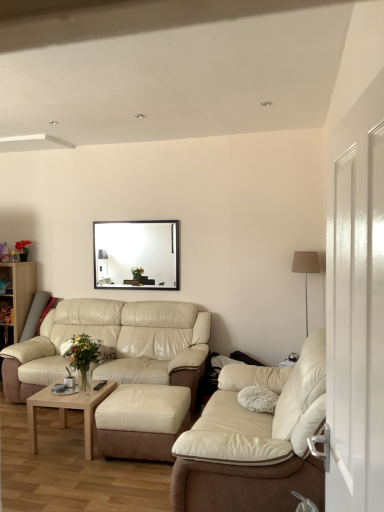
You are a GUI agent. You are given a task and a screenshot of the screen. Output one action in this format:
    pyautogui.click(x=<x>, y=<y>)
    Task: Click on the vacant area situated below light brown wooden coffee table at lower left (from a real-world perspective)
    The image size is (384, 512).
    Given the screenshot: What is the action you would take?
    pyautogui.click(x=68, y=438)